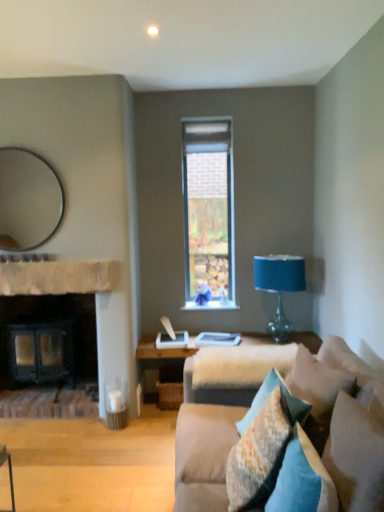
Question: From a real-world perspective, relative to textured beige pillow at lower right, marked as the 3th pillow in a front-to-back arrangement, is dark wood fireplace at left vertically above or below?

Choices:
 (A) above
 (B) below

Answer: (B)

Question: Considering the positions of dark wood fireplace at left and textured beige pillow at lower right, placed as the second pillow when sorted from back to front, in the image, is dark wood fireplace at left wider or thinner than textured beige pillow at lower right, placed as the second pillow when sorted from back to front,?

Choices:
 (A) wide
 (B) thin

Answer: (A)

Question: Considering the real-world distances, which object is farthest from the velvet blue pillow at lower right, positioned as the 2th pillow in front-to-back order?

Choices:
 (A) beige fur at center
 (B) textured blue pillow at lower right, the 1th pillow positioned from the back
 (C) blue glass table lamp at right
 (D) dark wood fireplace at left
 (E) brown stone fireplace at left

Answer: (D)

Question: Considering the real-world distances, which object is farthest from the velvet teal pillow at lower right, which is counted as the 4th pillow, starting from the back?

Choices:
 (A) matte silver mirror at upper left
 (B) brown stone fireplace at left
 (C) textured beige pillow at lower right, marked as the 3th pillow in a front-to-back arrangement
 (D) blue glass table lamp at right
 (E) beige fur at center

Answer: (A)